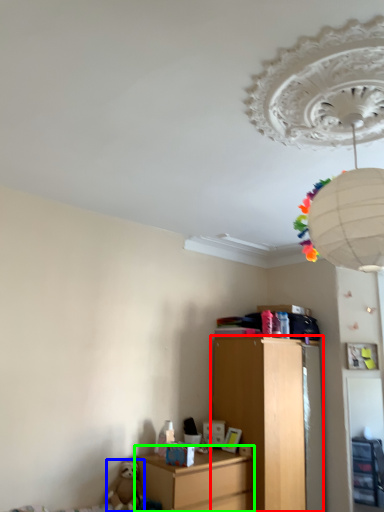
Question: Which object is the farthest from chest of drawers (highlighted by a red box)? Choose among these: toy (highlighted by a blue box) or nightstand (highlighted by a green box).

Choices:
 (A) toy
 (B) nightstand

Answer: (A)